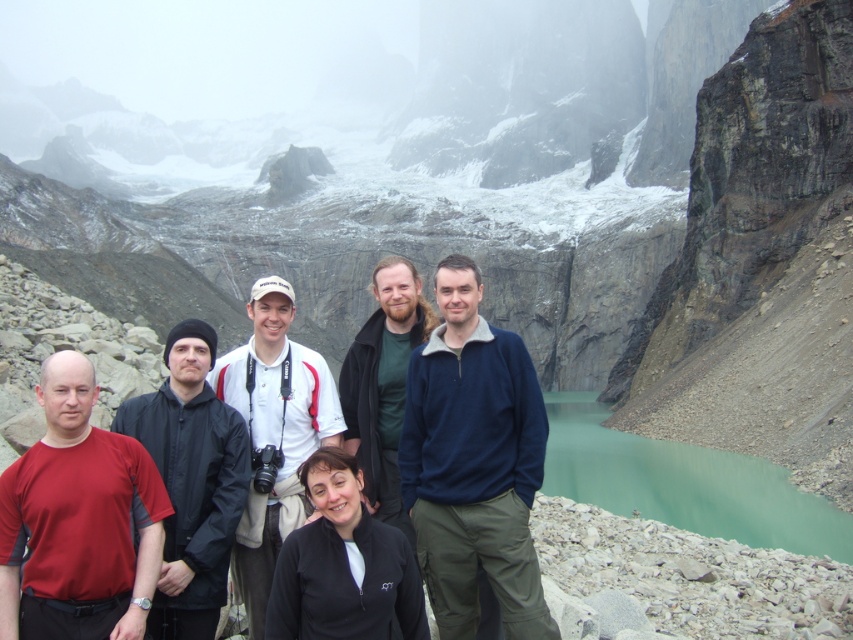
Question: Which of the following is the farthest from the observer?

Choices:
 (A) (505, 596)
 (B) (251, 589)
 (C) (293, 548)
 (D) (363, 356)

Answer: (D)

Question: Among these points, which one is nearest to the camera?

Choices:
 (A) (532, 449)
 (B) (387, 563)

Answer: (B)

Question: Is teal glassy water at lower right bigger than white cotton shirt at center?

Choices:
 (A) no
 (B) yes

Answer: (B)

Question: Which point is closer to the camera?

Choices:
 (A) (22, 499)
 (B) (181, 413)
 (C) (285, 554)
 (D) (495, 488)

Answer: (A)

Question: Is white cotton shirt at center closer to the viewer compared to matte green sweater at center?

Choices:
 (A) no
 (B) yes

Answer: (B)

Question: Is teal glassy water at lower right to the left of black fleece jacket at center from the viewer's perspective?

Choices:
 (A) no
 (B) yes

Answer: (A)